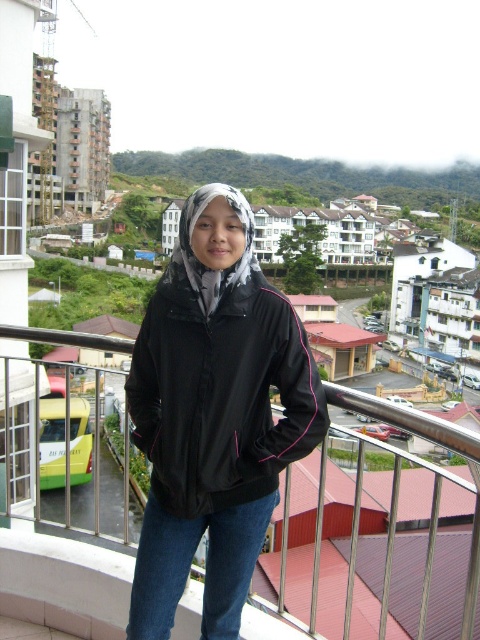
Question: Which object is positioned farthest from the metallic silver railing at upper center?

Choices:
 (A) blue denim jeans at lower center
 (B) black synthetic jacket at center

Answer: (A)

Question: Is blue denim jeans at lower center to the right of metallic silver railing at upper center from the viewer's perspective?

Choices:
 (A) no
 (B) yes

Answer: (A)

Question: Which of the following is the farthest from the observer?

Choices:
 (A) (392, 420)
 (B) (108, 570)

Answer: (B)

Question: Which of the following is the farthest from the observer?

Choices:
 (A) (123, 620)
 (B) (205, 358)

Answer: (A)

Question: Does blue denim jeans at lower center appear under metallic silver railing at upper center?

Choices:
 (A) no
 (B) yes

Answer: (A)

Question: Can you confirm if black synthetic jacket at center is thinner than metallic silver railing at upper center?

Choices:
 (A) yes
 (B) no

Answer: (A)